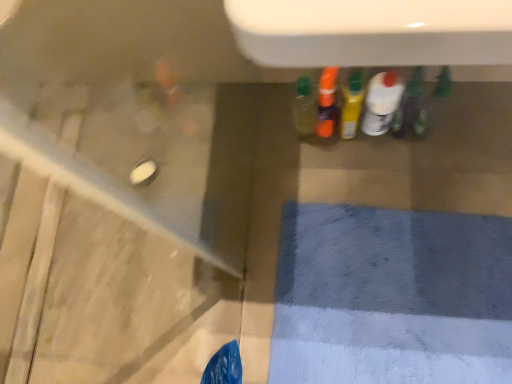
The width and height of the screenshot is (512, 384). What are the coordinates of `vacant space in front of white glossy bottle at center, the fourth bottle positioned from the left` in the screenshot? It's located at (407, 169).